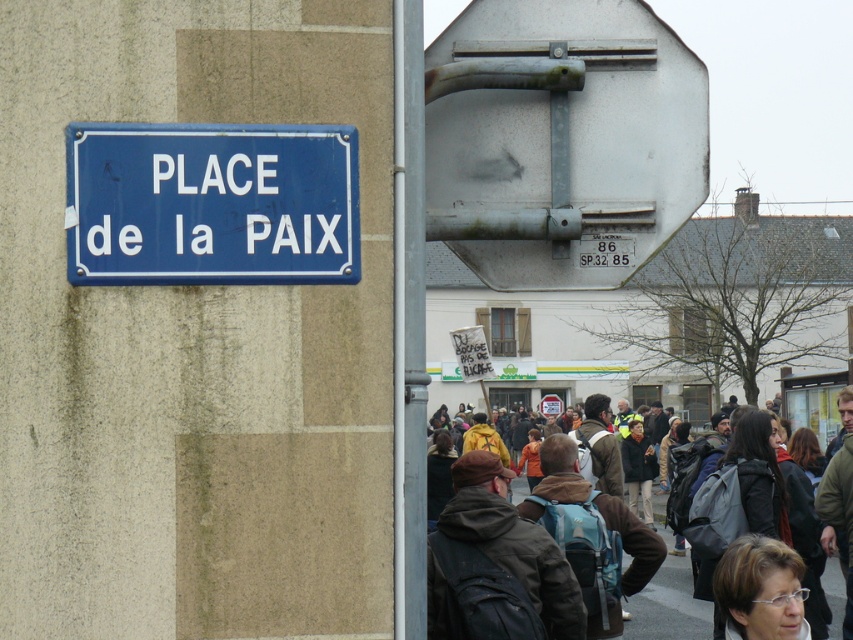
You are standing at the center of the image and want to locate the rusty metal basketball hoop at upper center. According to the coordinates provided, in which direction should you look to find it?

The rusty metal basketball hoop at upper center is located at coordinates point (561, 140). Since the question is about direction from the center, the x coordinate 0.220 is to the left of center and the y coordinate 0.659 is above center. Therefore, you should look to the upper left direction to find the rusty metal basketball hoop at upper center.

From the picture: You are a painter who needs to decide which object to paint first. Since you want to start with the larger one, which object should you choose between the rusty metal basketball hoop at upper center and the blue painted metal sign at upper left?

The rusty metal basketball hoop at upper center is bigger than the blue painted metal sign at upper left, so you should paint the rusty metal basketball hoop at upper center first.

You are standing in front of the blue sign on the beige wall. There are two points marked on the wall at coordinates point [633,118] and point [216,237]. Which point is closer to you?

Point [633,118] is further to the viewer than point [216,237], so the point closer to you is point [216,237].